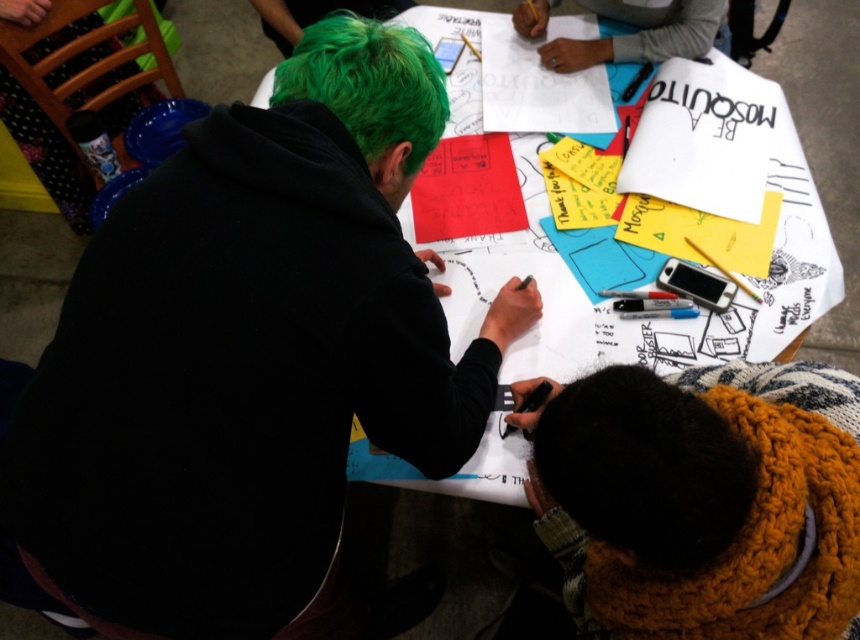
Question: Is black matte hoodie at upper left to the left of green matte hair at upper left from the viewer's perspective?

Choices:
 (A) no
 (B) yes

Answer: (A)

Question: Which point is closer to the camera taking this photo?

Choices:
 (A) (397, 49)
 (B) (723, 3)

Answer: (A)

Question: Can you confirm if black matte hoodie at upper left is wider than white paper at center?

Choices:
 (A) yes
 (B) no

Answer: (B)

Question: Which of the following is the farthest from the observer?

Choices:
 (A) brown fuzzy hat at lower center
 (B) white paper at center
 (C) black matte hoodie at upper left

Answer: (B)

Question: Observing the image, what is the correct spatial positioning of black matte hoodie at upper left in reference to brown fuzzy hat at lower center?

Choices:
 (A) right
 (B) left

Answer: (B)

Question: Which is nearer to the brown fuzzy hat at lower center?

Choices:
 (A) black matte hoodie at upper left
 (B) white paper at center
 (C) gray fabric at upper center

Answer: (A)